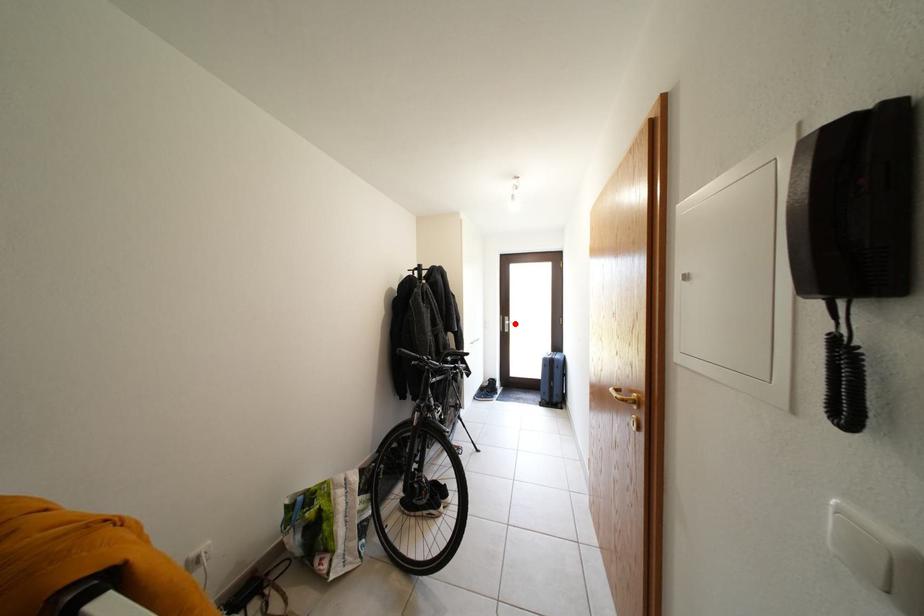
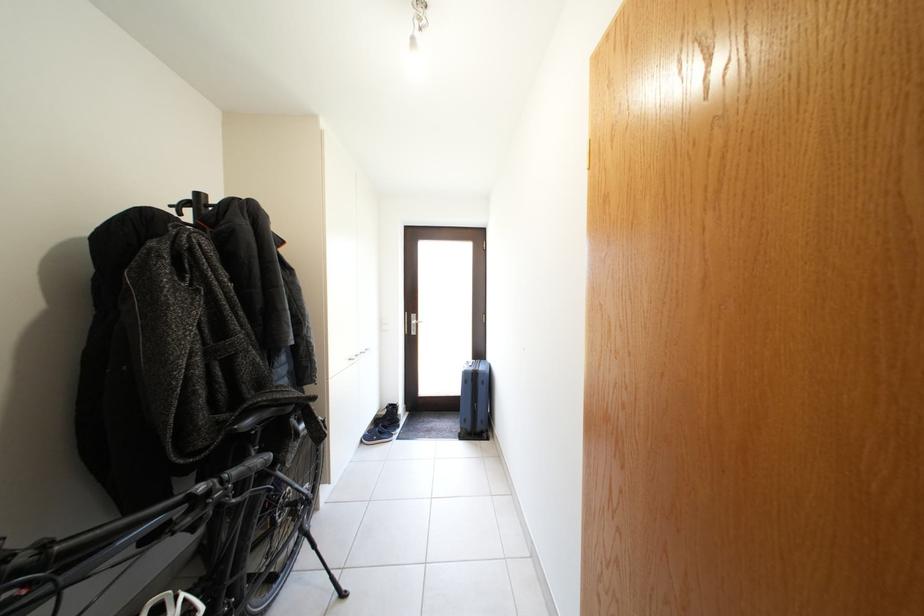
In the second image, find the point that corresponds to the highlighted location in the first image.

(421, 322)